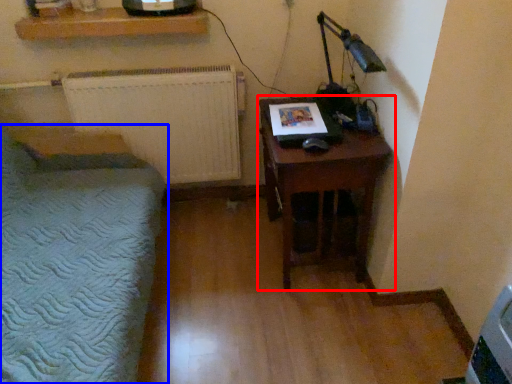
Question: Which of the following is the farthest to the observer, nightstand (highlighted by a red box) or furniture (highlighted by a blue box)?

Choices:
 (A) nightstand
 (B) furniture

Answer: (A)